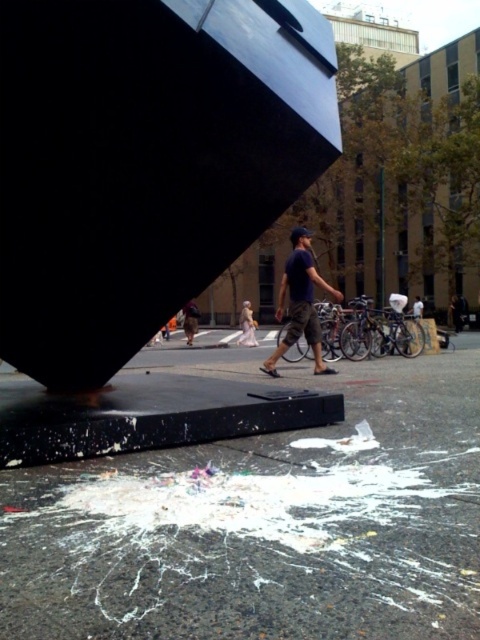
Is granite at lower center to the left of denim jacket at center from the viewer's perspective?

Incorrect, granite at lower center is not on the left side of denim jacket at center.

Can you confirm if granite at lower center is bigger than denim jacket at center?

No, granite at lower center is not bigger than denim jacket at center.

The image size is (480, 640). I want to click on granite at lower center, so click(x=265, y=524).

Is dark blue t-shirt at center positioned before denim jacket at center?

No.

Is dark blue t-shirt at center bigger than denim jacket at center?

Actually, dark blue t-shirt at center might be smaller than denim jacket at center.

Does point (321, 349) come closer to viewer compared to point (192, 314)?

Yes, it is in front of point (192, 314).

Where is `dark blue t-shirt at center`? This screenshot has height=640, width=480. dark blue t-shirt at center is located at coordinates (300, 304).

Can you confirm if dark blue t-shirt at center is positioned to the left of light brown fabric dress at center?

No, dark blue t-shirt at center is not to the left of light brown fabric dress at center.

Is dark blue t-shirt at center shorter than light brown fabric dress at center?

No.

Describe the element at coordinates (300, 304) in the screenshot. I see `dark blue t-shirt at center` at that location.

Where is `dark blue t-shirt at center`? This screenshot has width=480, height=640. dark blue t-shirt at center is located at coordinates (300, 304).